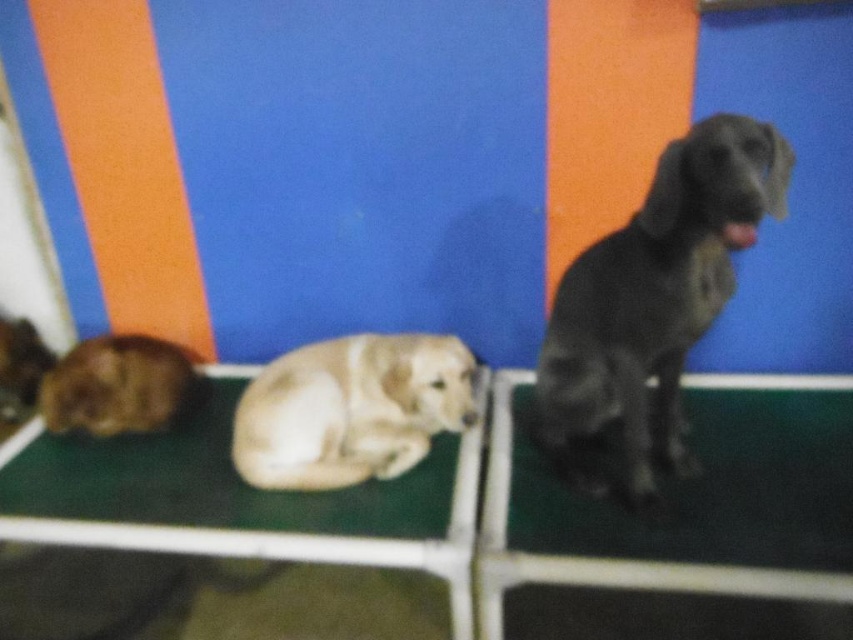
Question: Is white soft mat at center thinner than shiny brown fur at lower left?

Choices:
 (A) no
 (B) yes

Answer: (A)

Question: Is shiny black dog at right wider than white soft mat at center?

Choices:
 (A) yes
 (B) no

Answer: (B)

Question: Which of the following is the closest to the observer?

Choices:
 (A) (97, 348)
 (B) (711, 422)
 (C) (361, 387)

Answer: (C)

Question: Which object appears closest to the camera in this image?

Choices:
 (A) brown fur dog at left
 (B) black rubber mat at right
 (C) light brown fur at center
 (D) white soft mat at center

Answer: (B)

Question: Can you confirm if black rubber mat at right is thinner than light brown fur at center?

Choices:
 (A) no
 (B) yes

Answer: (A)

Question: Which point is closer to the camera?

Choices:
 (A) (1, 388)
 (B) (775, 438)
 (C) (601, 324)
 (D) (317, 433)

Answer: (C)